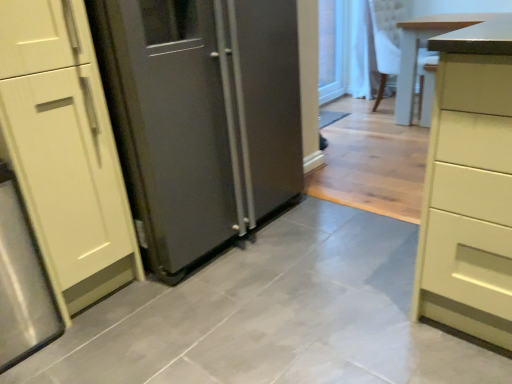
Question: Is light wood table at right at the left side of transparent glass door at upper right?

Choices:
 (A) no
 (B) yes

Answer: (A)

Question: Can you confirm if light wood table at right is positioned to the right of transparent glass door at upper right?

Choices:
 (A) no
 (B) yes

Answer: (B)

Question: Could you tell me if light wood table at right is facing transparent glass door at upper right?

Choices:
 (A) no
 (B) yes

Answer: (A)

Question: Considering the relative sizes of light wood table at right and transparent glass door at upper right in the image provided, is light wood table at right thinner than transparent glass door at upper right?

Choices:
 (A) yes
 (B) no

Answer: (B)

Question: From a real-world perspective, is light wood table at right under transparent glass door at upper right?

Choices:
 (A) no
 (B) yes

Answer: (B)

Question: Which is correct: transparent glass door at upper right is inside light wood table at right, or outside of it?

Choices:
 (A) outside
 (B) inside

Answer: (A)

Question: From their relative heights in the image, would you say transparent glass door at upper right is taller or shorter than light wood table at right?

Choices:
 (A) tall
 (B) short

Answer: (A)

Question: Considering the positions of point [321, 54] and point [457, 23], is point [321, 54] closer or farther from the camera than point [457, 23]?

Choices:
 (A) farther
 (B) closer

Answer: (A)

Question: Is transparent glass door at upper right bigger or smaller than light wood table at right?

Choices:
 (A) big
 (B) small

Answer: (B)

Question: Is light wood table at right wider or thinner than satin silver refrigerator at center?

Choices:
 (A) wide
 (B) thin

Answer: (A)

Question: From a real-world perspective, relative to satin silver refrigerator at center, is light wood table at right vertically above or below?

Choices:
 (A) above
 (B) below

Answer: (B)

Question: Considering their positions, is light wood table at right located in front of or behind satin silver refrigerator at center?

Choices:
 (A) behind
 (B) front

Answer: (A)

Question: Visually, is light wood table at right positioned to the left or to the right of satin silver refrigerator at center?

Choices:
 (A) left
 (B) right

Answer: (B)

Question: From a real-world perspective, is satin silver refrigerator at center physically located above or below transparent glass door at upper right?

Choices:
 (A) below
 (B) above

Answer: (B)

Question: From their relative heights in the image, would you say satin silver refrigerator at center is taller or shorter than transparent glass door at upper right?

Choices:
 (A) short
 (B) tall

Answer: (B)